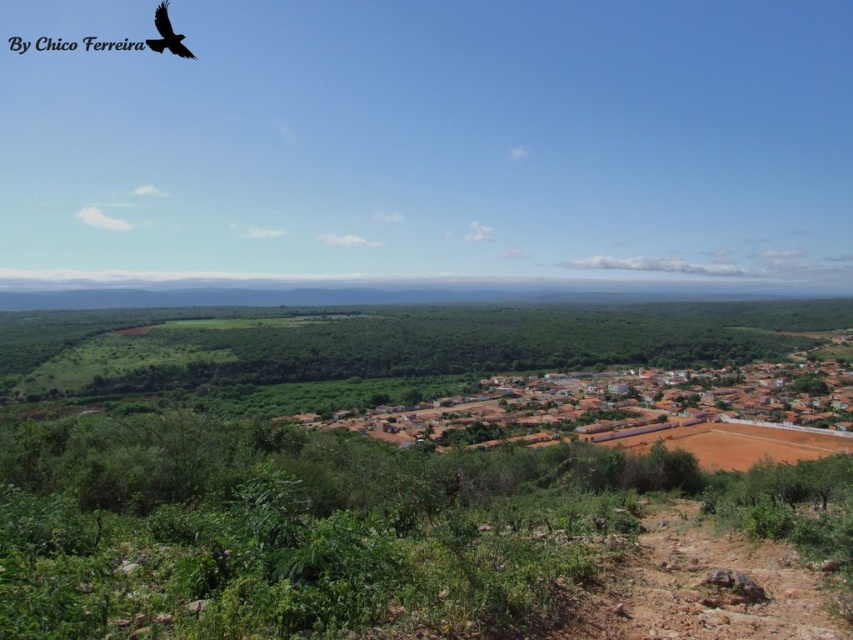
You are standing at the point marked as point (624, 404) in the image. What type of structures are you currently standing on?

You are standing on brown clay houses at center.